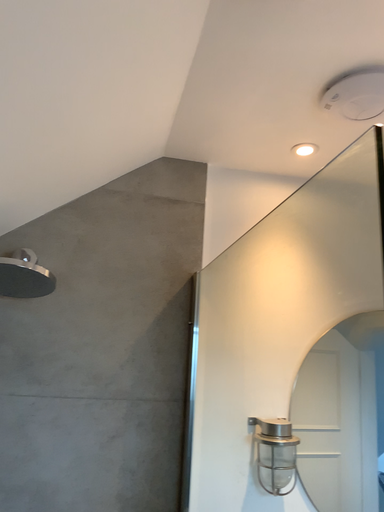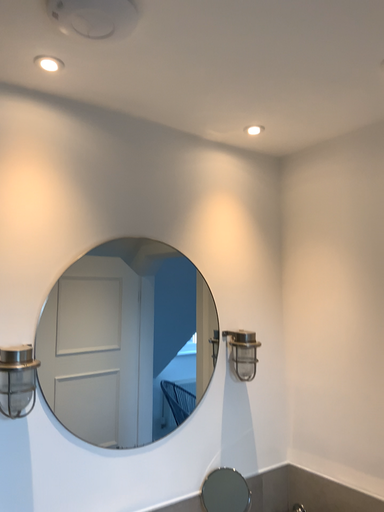
Question: How did the camera likely rotate when shooting the video?

Choices:
 (A) rotated right
 (B) rotated left

Answer: (A)